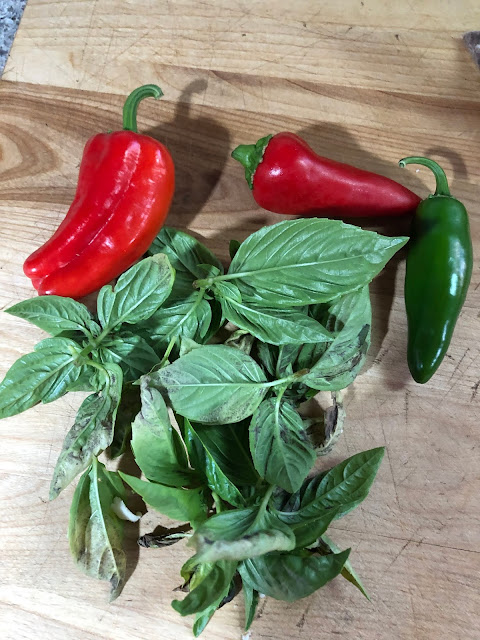
Find the location of `marble countertop`. marble countertop is located at coordinates (7, 22).